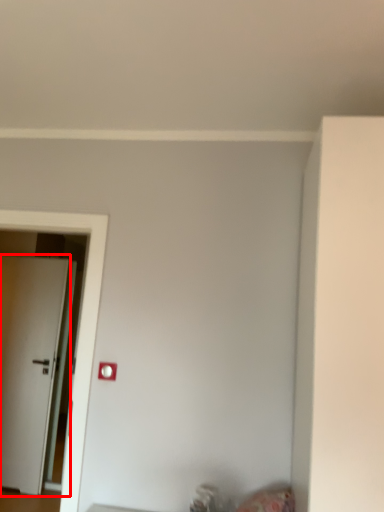
Question: From the image's perspective, where is door (annotated by the red box) located relative to light switch?

Choices:
 (A) above
 (B) below

Answer: (B)